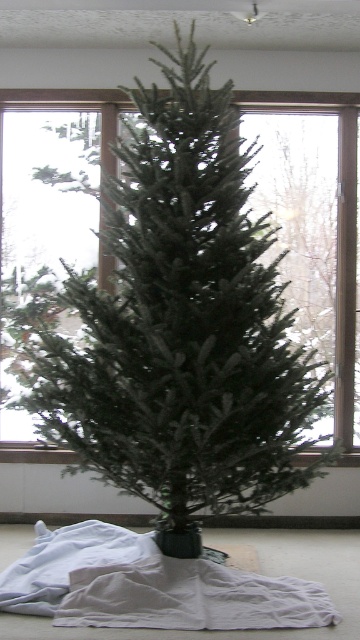
Question: From the image, what is the correct spatial relationship of white soft blanket at lower center in relation to transparent glass window at center?

Choices:
 (A) right
 (B) left

Answer: (B)

Question: Is white soft blanket at lower center smaller than transparent glass window at center?

Choices:
 (A) yes
 (B) no

Answer: (A)

Question: Does white soft blanket at lower center appear on the left side of transparent glass window at center?

Choices:
 (A) yes
 (B) no

Answer: (A)